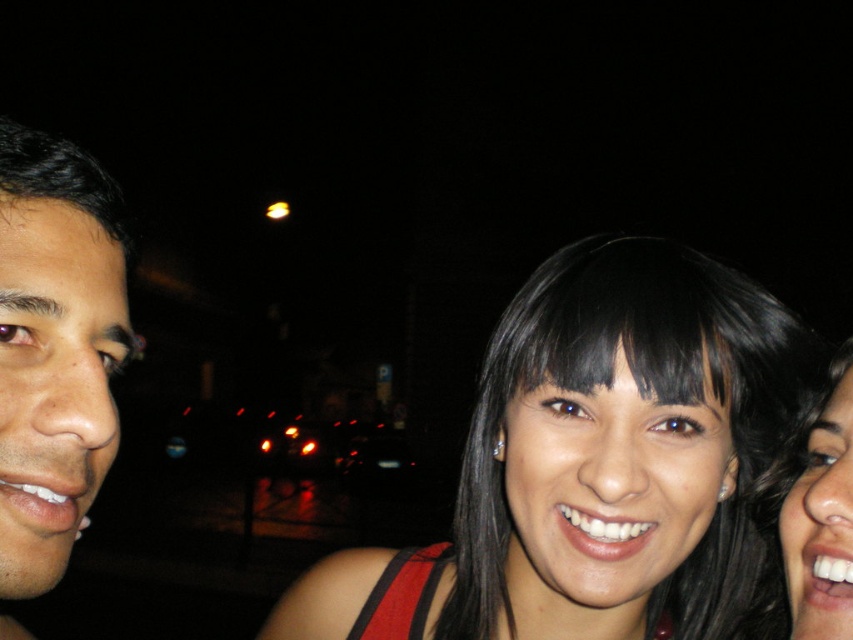
You are taking a photo of two people in a dark environment. You notice the smooth skin face at left and the black glossy hair at right. Which object should you focus on first to ensure both are in focus?

The smooth skin face at left should be focused on first because it is located above the black glossy hair at right, so adjusting focus starting from the higher positioned subject ensures both are in focus.